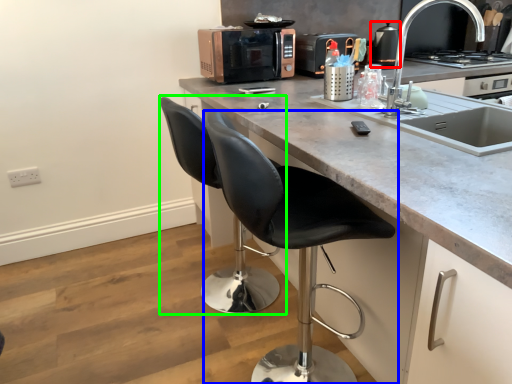
Question: Considering the real-world distances, which object is closest to appliance (highlighted by a red box)? chair (highlighted by a blue box) or swivel chair (highlighted by a green box).

Choices:
 (A) chair
 (B) swivel chair

Answer: (B)